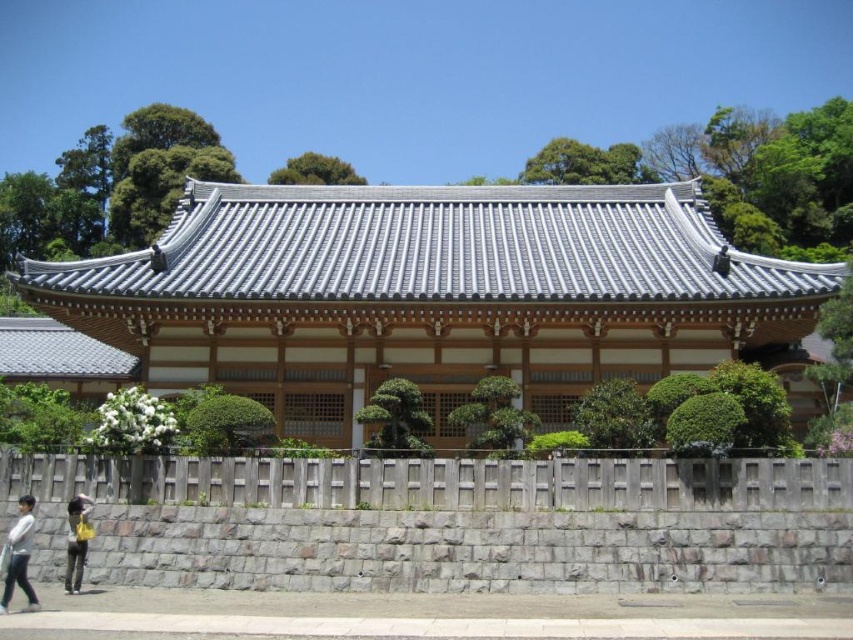
From the picture: Is gray tile roof at center taller than white cotton shirt at lower left?

Indeed, gray tile roof at center has a greater height compared to white cotton shirt at lower left.

Is gray tile roof at center smaller than white cotton shirt at lower left?

No, gray tile roof at center is not smaller than white cotton shirt at lower left.

This screenshot has width=853, height=640. Identify the location of gray tile roof at center. (431, 296).

Describe the element at coordinates (19, 554) in the screenshot. I see `white cotton shirt at lower left` at that location.

Describe the element at coordinates (19, 554) in the screenshot. Image resolution: width=853 pixels, height=640 pixels. I see `white cotton shirt at lower left` at that location.

Find the location of a particular element. The height and width of the screenshot is (640, 853). white cotton shirt at lower left is located at coordinates (19, 554).

Between gray tile roof at center and yellow fabric bag at lower left, which one is positioned lower?

→ yellow fabric bag at lower left is lower down.

Does gray tile roof at center have a larger size compared to yellow fabric bag at lower left?

Yes, gray tile roof at center is bigger than yellow fabric bag at lower left.

The width and height of the screenshot is (853, 640). In order to click on gray tile roof at center in this screenshot , I will do `click(431, 296)`.